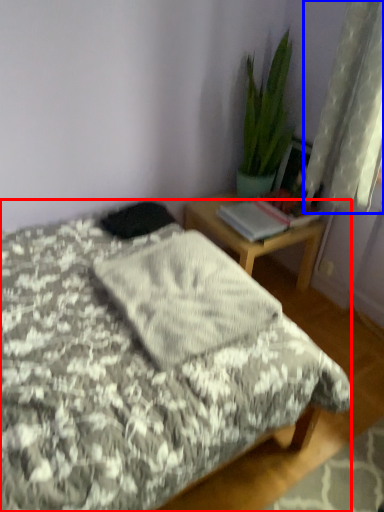
Question: Which point is closer to the camera, bed (highlighted by a red box) or curtain (highlighted by a blue box)?

Choices:
 (A) bed
 (B) curtain

Answer: (A)